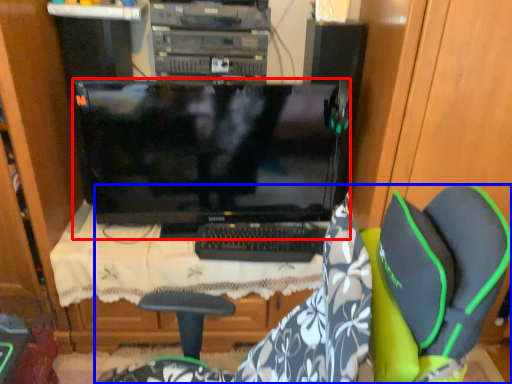
Question: Which point is closer to the camera, computer monitor (highlighted by a red box) or chair (highlighted by a blue box)?

Choices:
 (A) computer monitor
 (B) chair

Answer: (B)